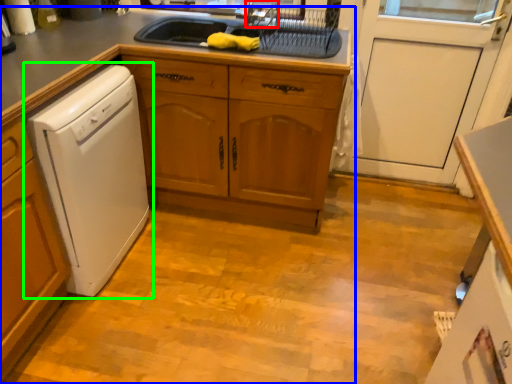
Question: Based on their relative distances, which object is nearer to faucet (highlighted by a red box)? Choose from countertop (highlighted by a blue box) and home appliance (highlighted by a green box).

Choices:
 (A) countertop
 (B) home appliance

Answer: (A)